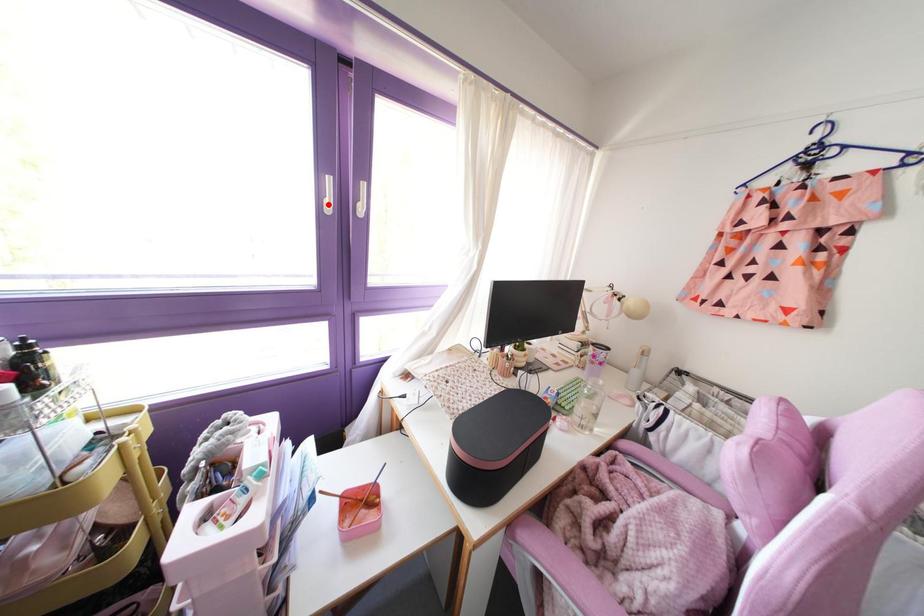
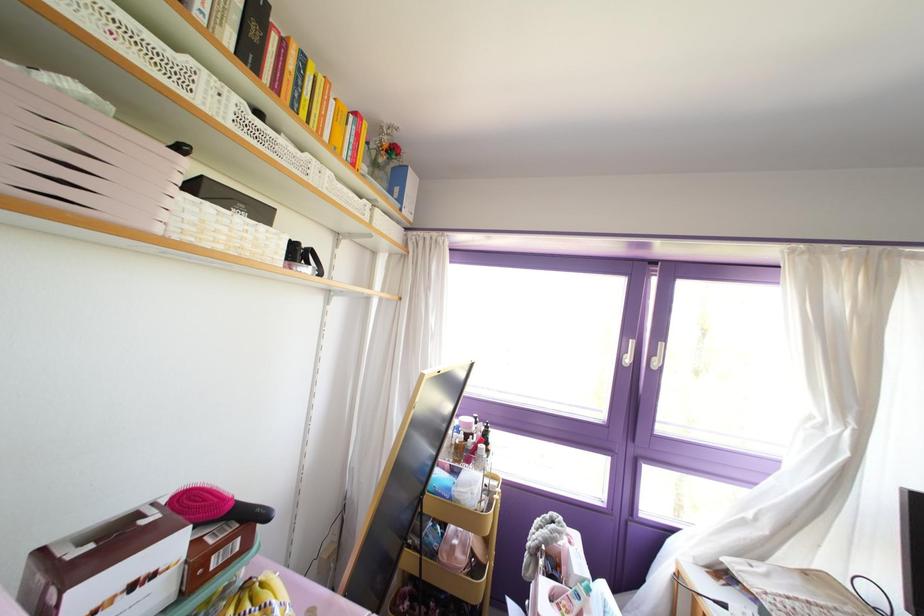
Find the pixel in the second image that matches the highlighted location in the first image.

(626, 360)